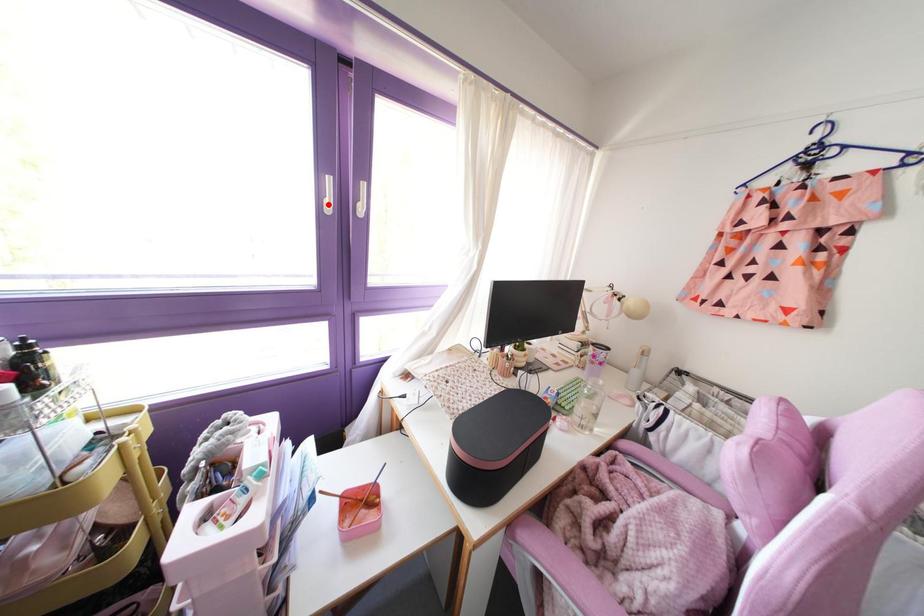
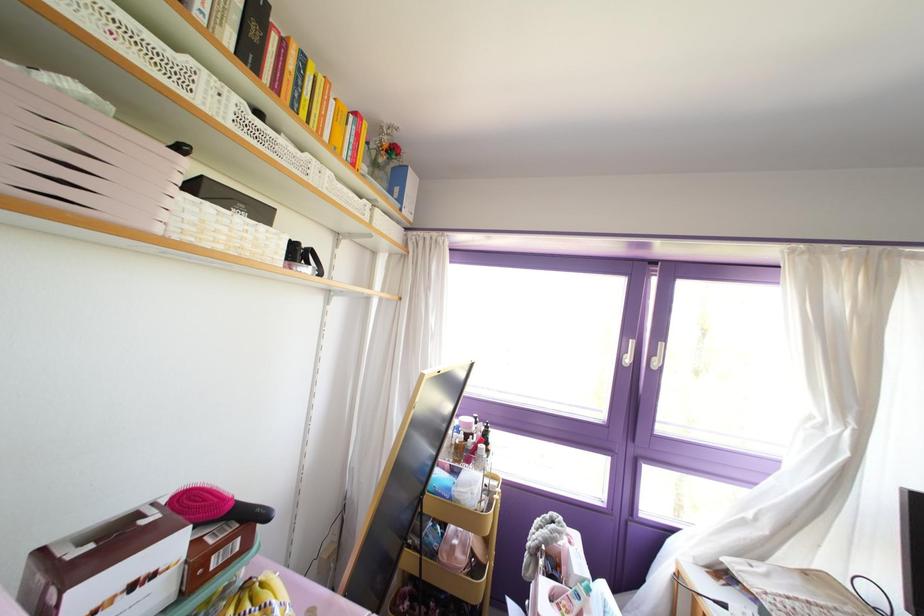
Find the pixel in the second image that matches the highlighted location in the first image.

(626, 360)